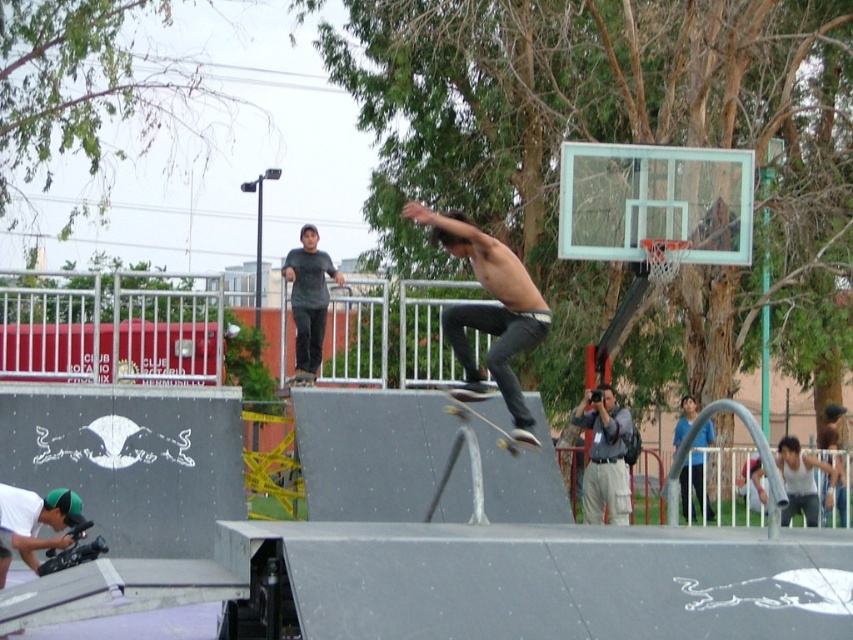
Is point (590, 524) farther from camera compared to point (318, 278)?

Yes, it is behind point (318, 278).

Is point (612, 435) in front of point (299, 307)?

No.

This screenshot has height=640, width=853. Find the location of `gray fabric camera at center`. gray fabric camera at center is located at coordinates (604, 456).

Is shiny black skateboard at center further to camera compared to wooden smooth skateboard at center?

No, shiny black skateboard at center is closer to the viewer.

Which is more to the right, shiny black skateboard at center or wooden smooth skateboard at center?

wooden smooth skateboard at center

Between point (520, 307) and point (456, 408), which one is positioned behind?

Point (456, 408)

Identify the location of shiny black skateboard at center. (489, 310).

Measure the distance between point (289, 280) and camera.

Point (289, 280) is 23.76 meters from camera.

From the picture: Between dark gray shirt at upper center and wooden smooth skateboard at center, which one appears on the right side from the viewer's perspective?

From the viewer's perspective, wooden smooth skateboard at center appears more on the right side.

Describe the element at coordinates (308, 300) in the screenshot. The height and width of the screenshot is (640, 853). I see `dark gray shirt at upper center` at that location.

The image size is (853, 640). What are the coordinates of `dark gray shirt at upper center` in the screenshot? It's located at (308, 300).